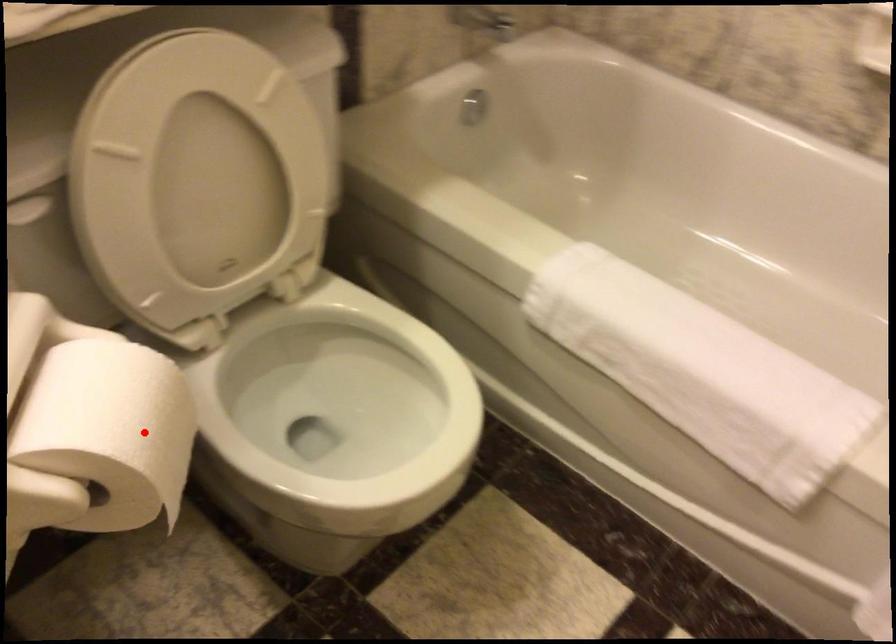
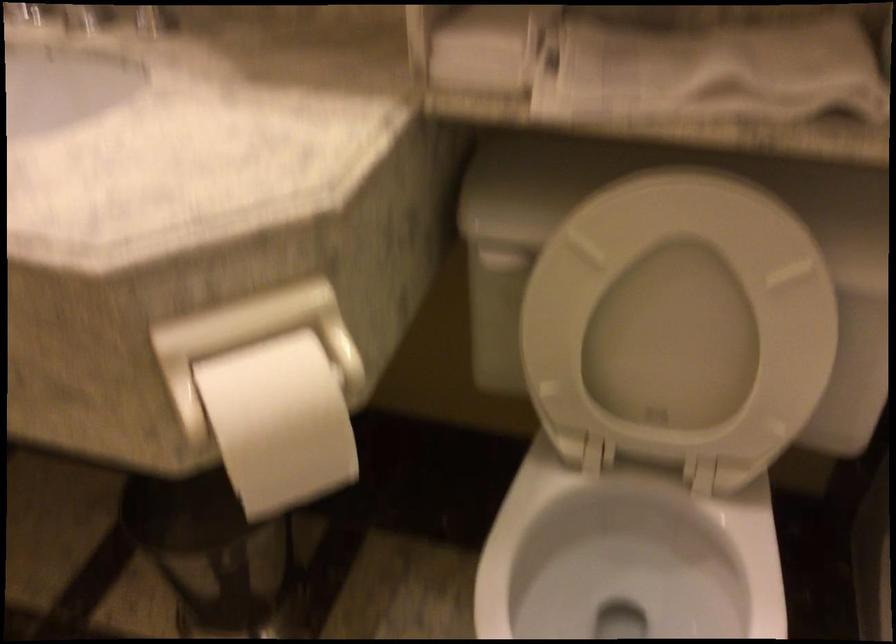
Locate, in the second image, the point that corresponds to the highlighted location in the first image.

(279, 422)